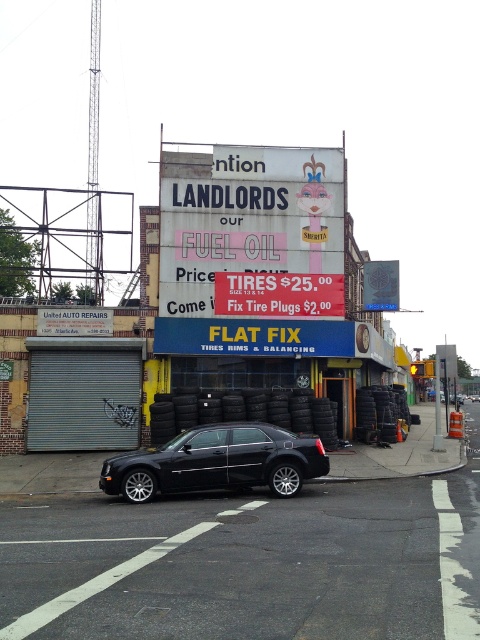
Question: Which of these objects is positioned closest to the black rubber tire at lower left?

Choices:
 (A) silver metallic tire at lower center
 (B) white paper sign at center

Answer: (A)

Question: Does black matte car at center appear under black rubber tire at center?

Choices:
 (A) no
 (B) yes

Answer: (B)

Question: Is black rubber tire at center bigger than silver metallic tire at lower center?

Choices:
 (A) no
 (B) yes

Answer: (B)

Question: Which point is closer to the camera taking this photo?

Choices:
 (A) (205, 451)
 (B) (147, 486)
 (C) (389, 410)

Answer: (B)

Question: Which of the following is the farthest from the observer?

Choices:
 (A) white paper sign at center
 (B) black matte car at center

Answer: (A)

Question: Can you confirm if white paper sign at center is positioned below black rubber tire at center?

Choices:
 (A) no
 (B) yes

Answer: (A)